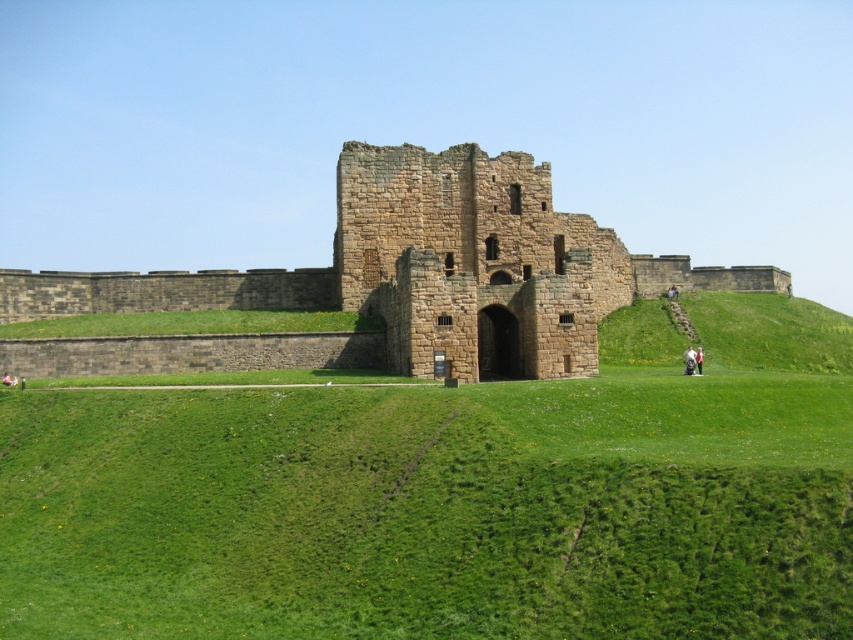
You are standing at the base of the hill looking up at the castle. Which object is positioned to the left of the other between the green grassy at center and the brown stone castle at center?

The green grassy at center is positioned to the left of the brown stone castle at center.